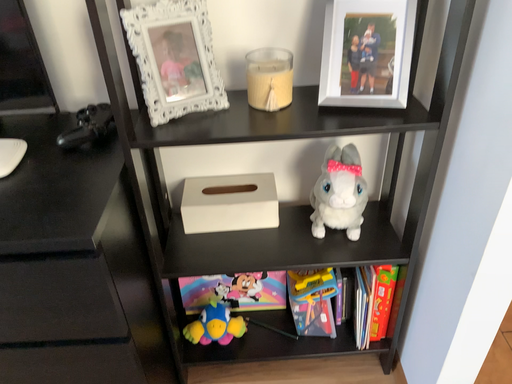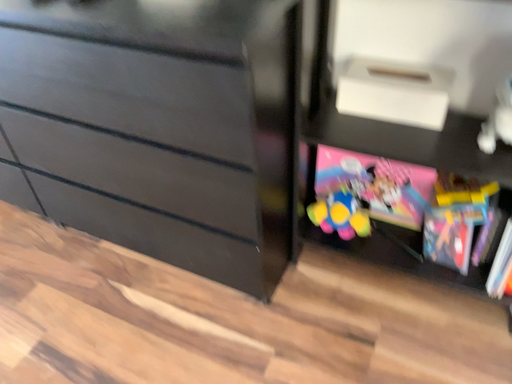
Question: Which way did the camera rotate in the video?

Choices:
 (A) rotated left
 (B) rotated right

Answer: (A)